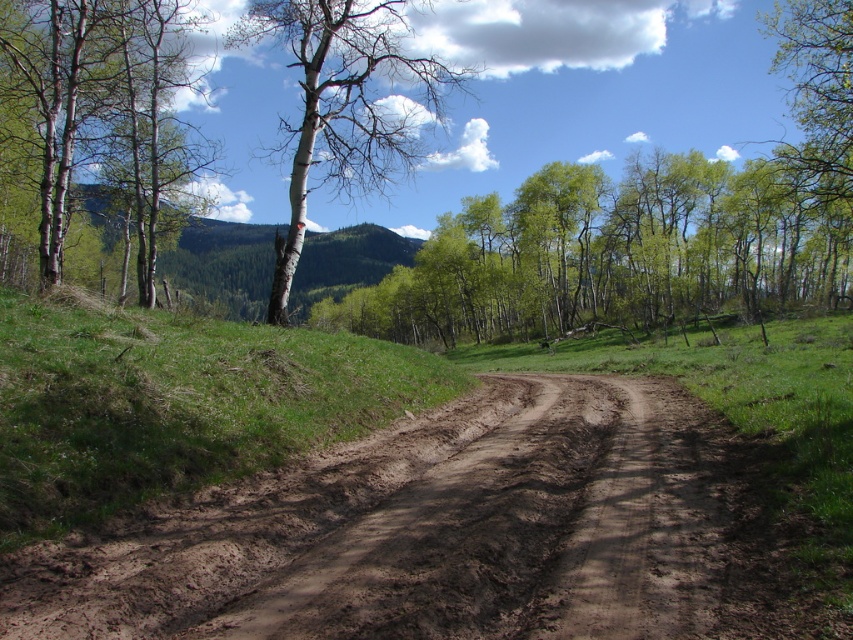
You are standing on the dirt road and want to climb up the green grassy hillside at left. Is the smooth white tree at left taller than the hillside you want to climb?

The green grassy hillside at left is shorter than the smooth white tree at left, so yes, the smooth white tree at left is taller than the hillside you want to climb.

In the scene shown: You are a hiker standing on the dirt road and want to rest under a tree. Which tree would provide more shade if the green leafy tree at center has a wider canopy than the smooth white tree at left?

The green leafy tree at center would provide more shade because it has a wider canopy than the smooth white tree at left.

You are standing at the starting point of the dirt road and see the point marked at coordinate [616,253]. What object is located at that point?

The point at coordinate [616,253] marks a green leafy tree at center.